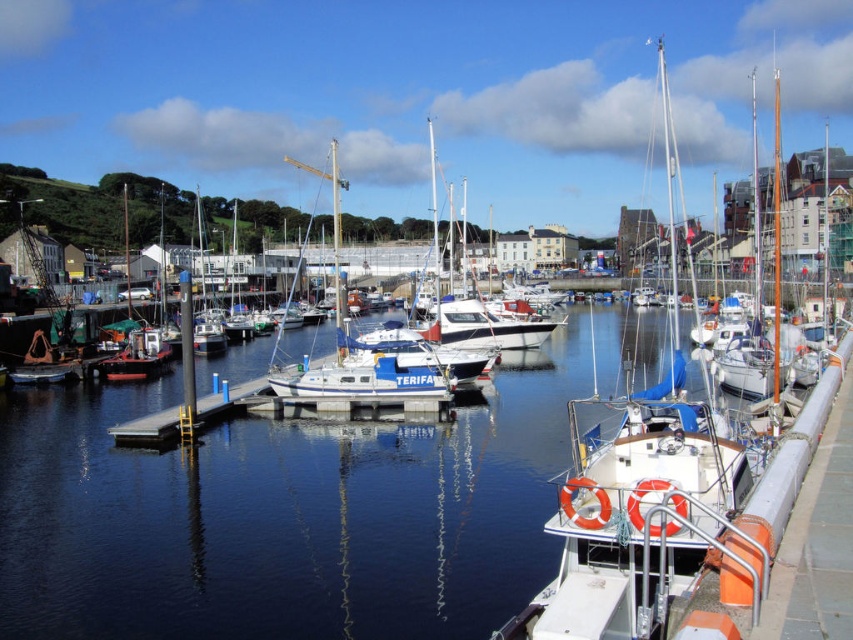
Question: Which point appears closest to the camera in this image?

Choices:
 (A) (3, 525)
 (B) (146, 346)

Answer: (A)

Question: Which of the following is the farthest from the observer?

Choices:
 (A) (753, 236)
 (B) (570, 538)
 (C) (334, 260)

Answer: (C)

Question: Does white glossy sailboat at center appear on the right side of matte white sailboat at left?

Choices:
 (A) yes
 (B) no

Answer: (A)

Question: Does white glossy sailboat at center have a greater width compared to matte white sailboat at left?

Choices:
 (A) yes
 (B) no

Answer: (B)

Question: Is the position of white matte sailboat at center less distant than that of matte white sailboat at left?

Choices:
 (A) yes
 (B) no

Answer: (A)

Question: Among these points, which one is nearest to the camera?

Choices:
 (A) (332, 166)
 (B) (431, 192)
 (C) (120, 349)
 (D) (598, 461)

Answer: (D)